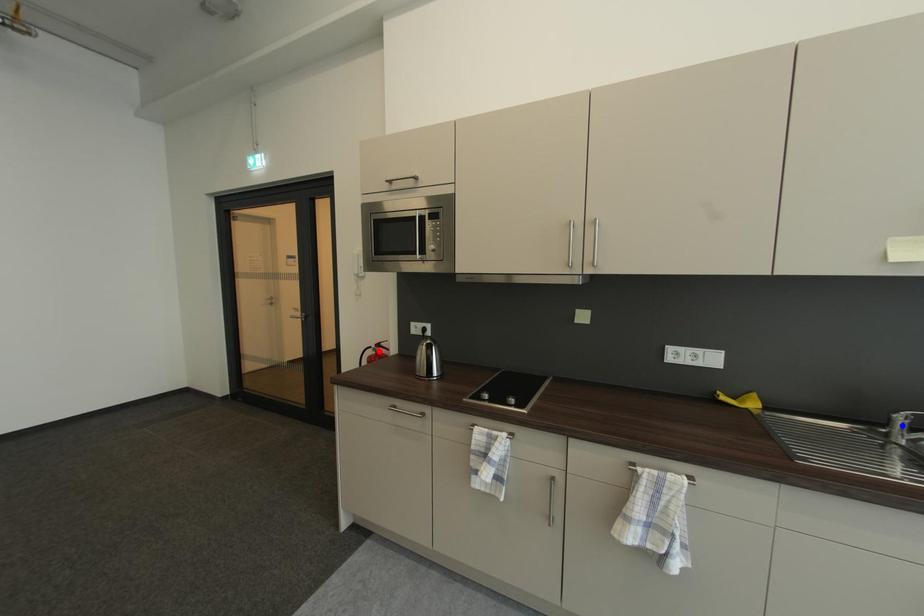
Question: In the image, two points are highlighted. Which point is nearer to the camera? Reply with the corresponding letter.

Choices:
 (A) blue point
 (B) red point

Answer: (A)